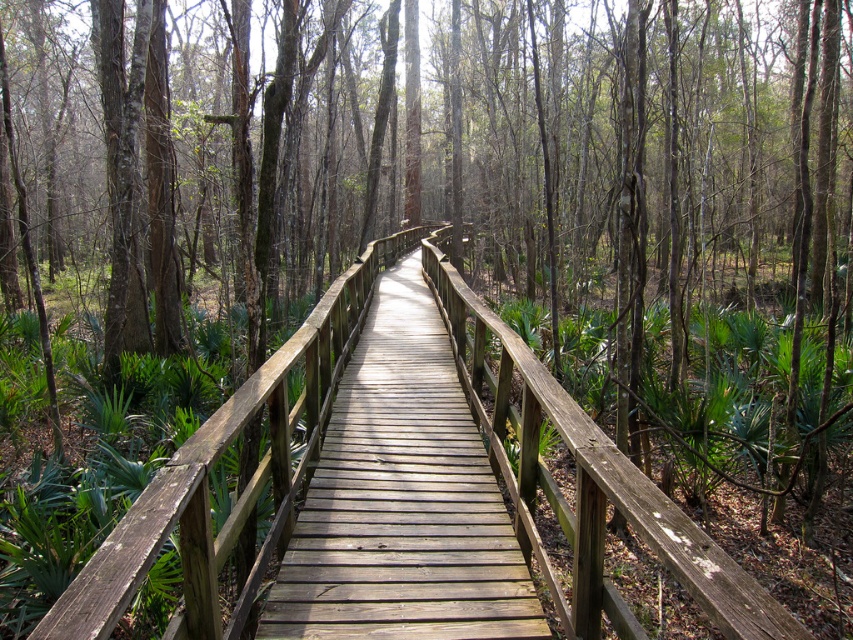
You are standing on the wooden boardwalk in the forest. You see two points marked on the boardwalk at coordinates point (312, 310) and point (389, 298). If you are facing the direction of the boardwalk, which point is closer to you?

Point (312, 310) is in front of point (389, 298), so the point closer to you is point (312, 310).

You are a hiker trying to cross the forest path. You see two bridges ahead, the natural wood bridge at center and the light brown wooden bridge at center. Which bridge should you take if you need to cross a wider gap?

The natural wood bridge at center is larger in size than the light brown wooden bridge at center, so it can handle wider gaps. Therefore, you should take the natural wood bridge at center.

You are a hiker carrying a backpack that is 1 meter wide. You are standing at the start of the boardwalk and want to cross to the other side of the natural wood bridge at center. Can your backpack fit through the space between the bridge and the camera?

The distance between the natural wood bridge at center and the camera is 1.20 meters, which is wider than your backpack of 1 meter. Therefore, your backpack can fit through the space between the natural wood bridge at center and the camera.